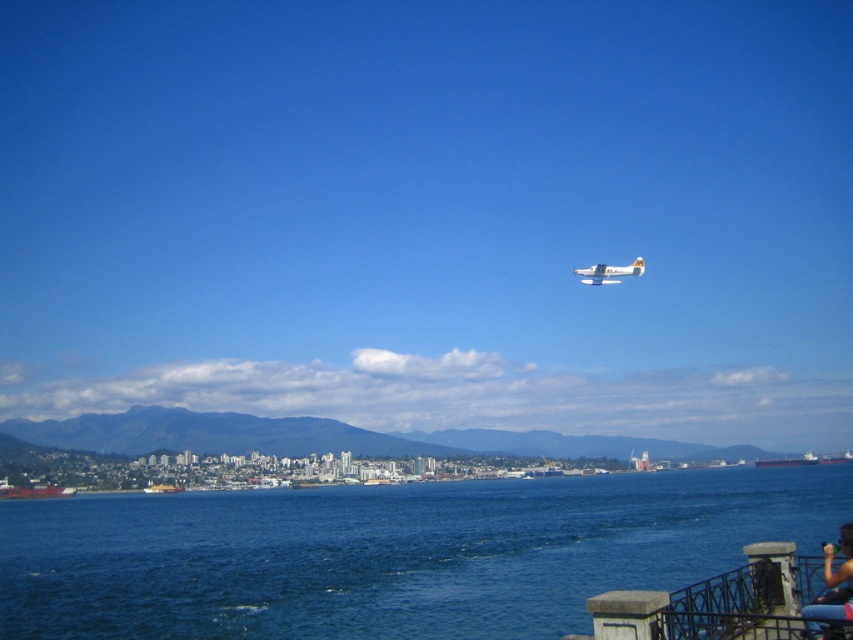
Does blue water at lower center have a greater width compared to blue denim jeans at lower right?

Correct, the width of blue water at lower center exceeds that of blue denim jeans at lower right.

Between point (61, 605) and point (831, 580), which one is positioned behind?

Point (61, 605)

Measure the distance between blue water at lower center and camera.

blue water at lower center is 53.55 feet from camera.

Identify the location of blue water at lower center. The image size is (853, 640). (392, 554).

Is point (845, 502) in front of point (643, 266)?

That is True.

Which is more to the right, blue water at lower center or white matte airplane at upper center?

From the viewer's perspective, white matte airplane at upper center appears more on the right side.

What do you see at coordinates (392, 554) in the screenshot? I see `blue water at lower center` at bounding box center [392, 554].

The height and width of the screenshot is (640, 853). Find the location of `blue water at lower center`. blue water at lower center is located at coordinates (392, 554).

Locate an element on the screen. The image size is (853, 640). blue denim jeans at lower right is located at coordinates (834, 582).

Between blue denim jeans at lower right and white matte airplane at upper center, which one has more height?

white matte airplane at upper center

Where is `blue denim jeans at lower right`? The width and height of the screenshot is (853, 640). blue denim jeans at lower right is located at coordinates (834, 582).